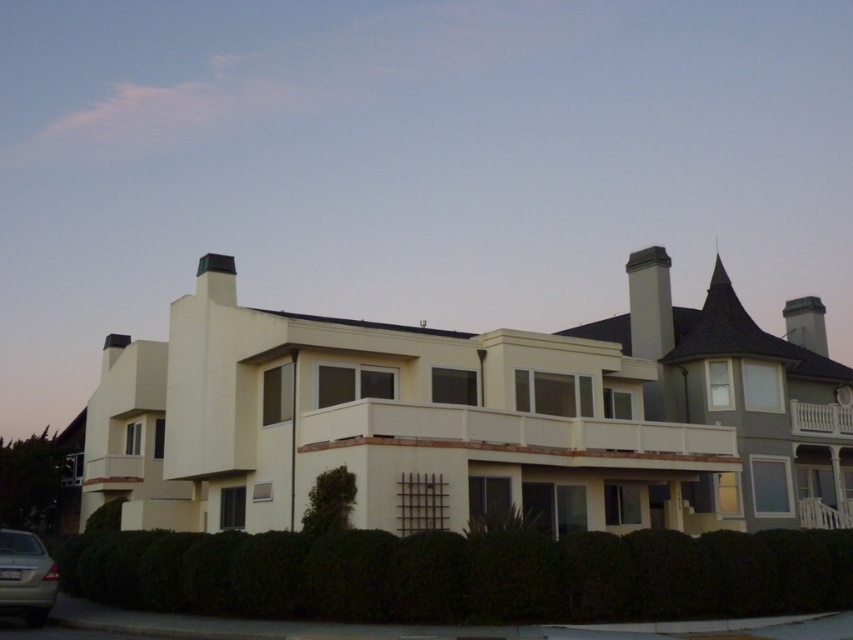
Question: Can you confirm if green leafy hedge at lower center is positioned above silver metallic car at lower left?

Choices:
 (A) yes
 (B) no

Answer: (B)

Question: Can you confirm if green leafy hedge at lower center is bigger than silver metallic car at lower left?

Choices:
 (A) yes
 (B) no

Answer: (A)

Question: Is green leafy hedge at lower center positioned behind silver metallic car at lower left?

Choices:
 (A) no
 (B) yes

Answer: (A)